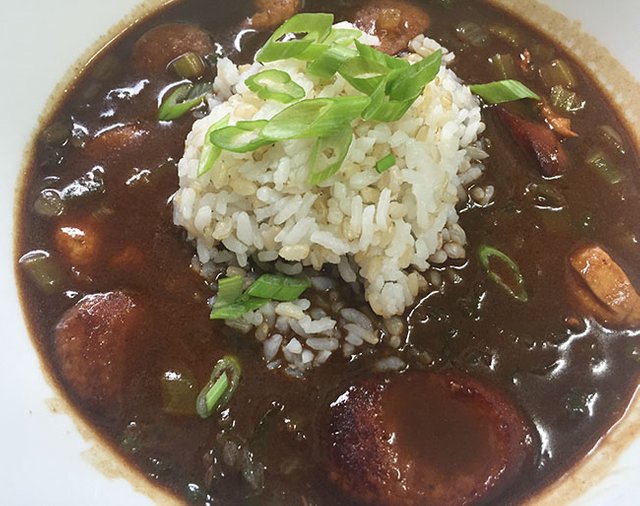
The height and width of the screenshot is (506, 640). Identify the location of bowl. (596, 54).